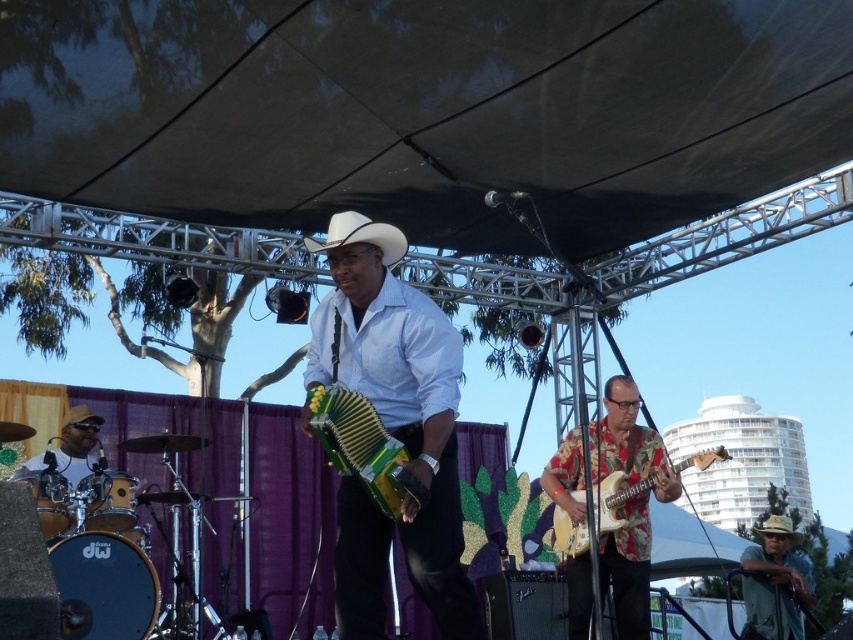
Question: Which point is closer to the camera?

Choices:
 (A) (30, 460)
 (B) (380, 236)

Answer: (B)

Question: Does floral fabric guitar at right lie behind green fabric hat at lower right?

Choices:
 (A) yes
 (B) no

Answer: (B)

Question: Estimate the real-world distances between objects in this image. Which object is closer to the white matte cowboy hat at center?

Choices:
 (A) green/yellow plastic accordion at center
 (B) floral fabric guitar at right
 (C) green fabric hat at lower right
 (D) green matte accordion at center

Answer: (D)

Question: Can you confirm if floral fabric guitar at right is positioned above floral fabric guitar at center?

Choices:
 (A) yes
 (B) no

Answer: (B)

Question: Does green matte accordion at center appear under floral fabric guitar at right?

Choices:
 (A) no
 (B) yes

Answer: (A)

Question: Which object is farther from the camera taking this photo?

Choices:
 (A) green matte accordion at center
 (B) floral fabric guitar at center

Answer: (B)